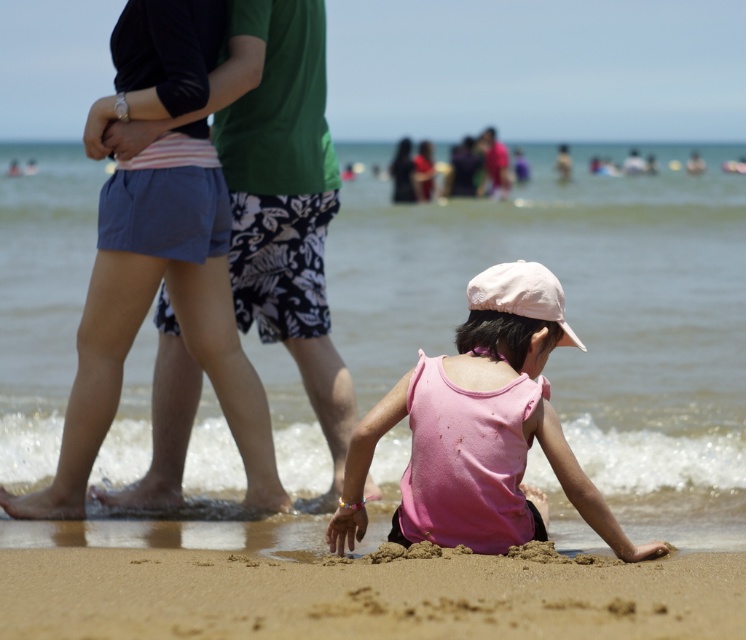
You are a photographer trying to capture the beach scene. You notice the matte blue shorts at left and the pink matte tank top at lower center. Which object should you zoom in on to focus on the larger one?

The matte blue shorts at left is larger in size than the pink matte tank top at lower center, so you should zoom in on the matte blue shorts at left to focus on the larger one.

You are a drone operator trying to capture the child playing in the sand. Your drone is currently hovering at point (363, 595). What is located at this point?

The point (363, 595) is where the fine grained sand at lower center is located.

You are standing at point [147,80] and want to walk to the shoreline where the child is playing. Which direction should you go to reach the shoreline without passing through point [574,605]?

Since point [574,605] is in front of point [147,80], you should go around either to the left or right of point [574,605] to reach the shoreline without passing through it.